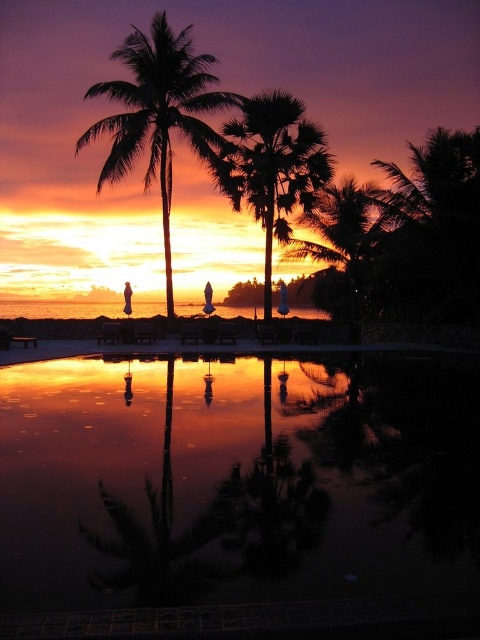
Which is more to the left, silhouette leafy palm at center or white cotton dress at center?

Positioned to the left is white cotton dress at center.

Is point (266, 141) behind point (131, 300)?

That is False.

Is point (252, 184) closer to viewer compared to point (126, 285)?

Yes, it is.

Locate an element on the screen. The image size is (480, 640). silhouette leafy palm at center is located at coordinates (272, 166).

Does dark green leafy palm tree at upper right appear on the right side of white cotton dress at center?

Yes, dark green leafy palm tree at upper right is to the right of white cotton dress at center.

Does point (428, 282) come behind point (128, 292)?

Yes.

I want to click on dark green leafy palm tree at upper right, so click(x=433, y=225).

I want to click on dark green leafy palm tree at upper right, so click(433, 225).

Is dark green leafy palm tree at upper right shorter than silhouette leafy palm at center?

No, dark green leafy palm tree at upper right is not shorter than silhouette leafy palm at center.

Who is more forward, [432,198] or [240,193]?

Point [432,198] is in front.

What are the coordinates of `dark green leafy palm tree at upper right` in the screenshot? It's located at (433, 225).